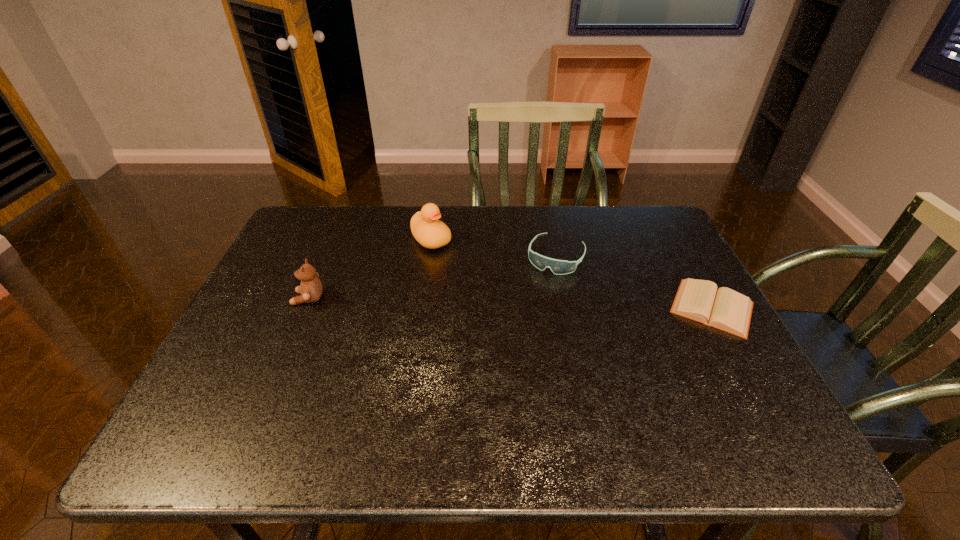
Image resolution: width=960 pixels, height=540 pixels. Find the location of `free spot on the desktop that is between the leftmost object and the shortest object and is positioned on the face of the third object from right to left`. free spot on the desktop that is between the leftmost object and the shortest object and is positioned on the face of the third object from right to left is located at coordinates (502, 302).

What are the coordinates of `vacant space on the desktop that is between the teddy bear and the shortest object and is positioned on the front-facing side of the goggles` in the screenshot? It's located at (532, 303).